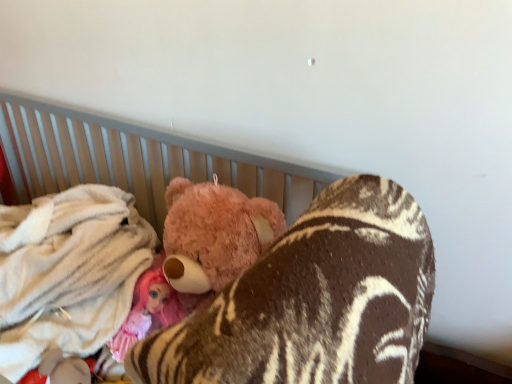
Consider the image. In order to face white plush blanket at lower left, should I rotate leftwards or rightwards?

It's best to rotate left around 29.122 degrees.

What do you see at coordinates (68, 272) in the screenshot? This screenshot has height=384, width=512. I see `white plush blanket at lower left` at bounding box center [68, 272].

Identify the location of white plush blanket at lower left. This screenshot has width=512, height=384. (68, 272).

You are a GUI agent. You are given a task and a screenshot of the screen. Output one action in this format:
    pyautogui.click(x=<x>, y=<y>)
    Task: Click on the white plush blanket at lower left
    This screenshot has height=384, width=512.
    Given the screenshot: What is the action you would take?
    pyautogui.click(x=68, y=272)